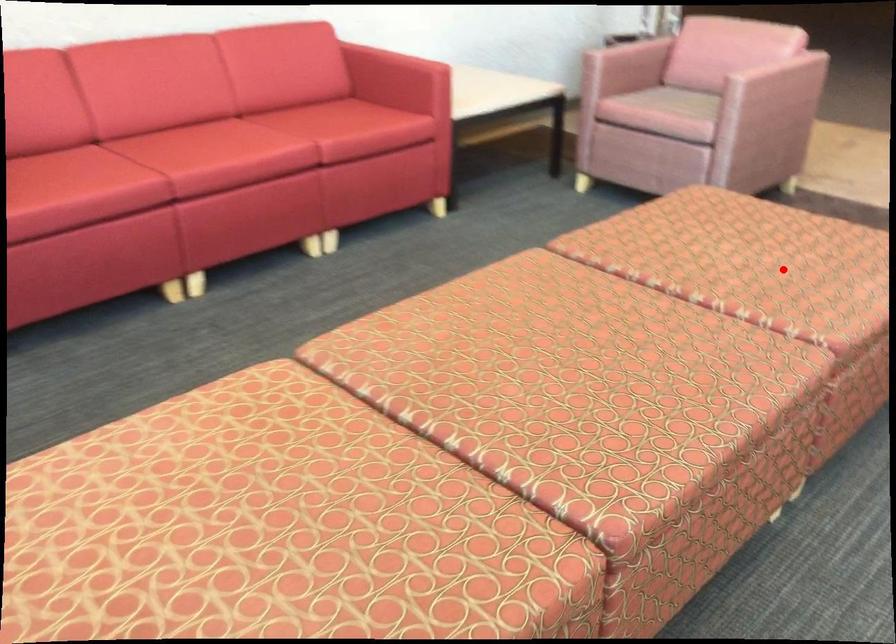
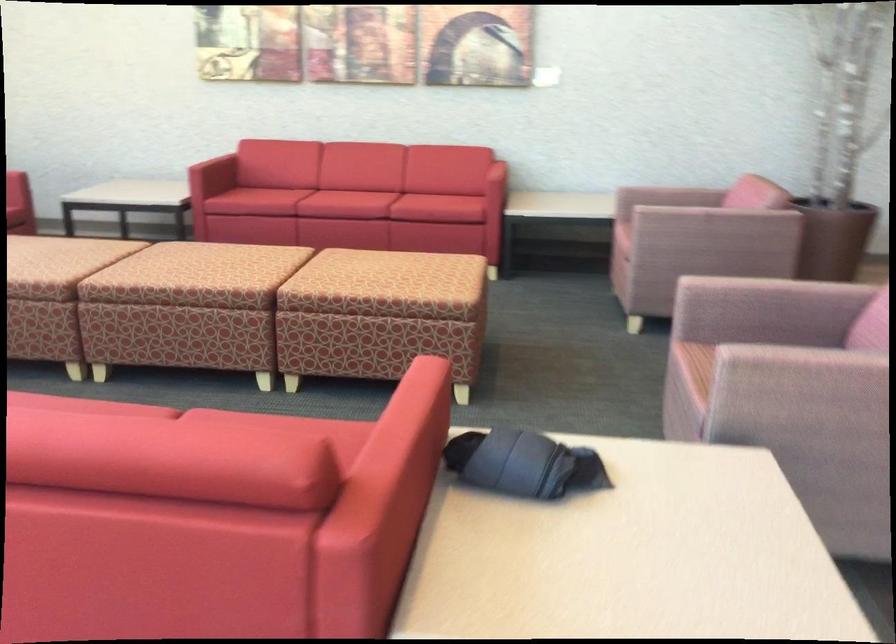
Question: I am providing you with two images of the same scene from different viewpoints. Given a red point in image1, look at the same physical point in image2. Is it:

Choices:
 (A) Closer to the viewpoint
 (B) Farther from the viewpoint

Answer: (B)